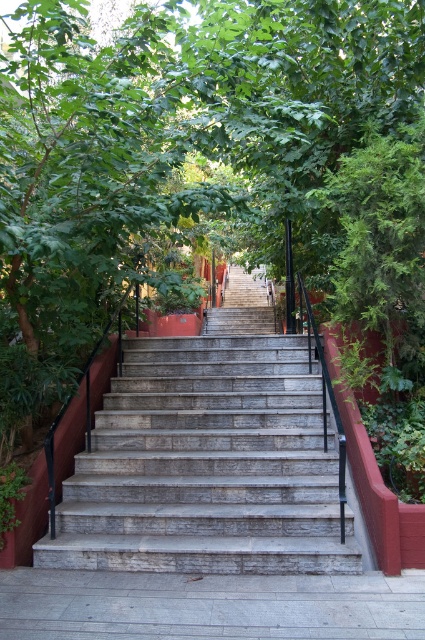
Question: Which point appears closest to the camera in this image?

Choices:
 (A) (166, 564)
 (B) (204, 179)

Answer: (A)

Question: Is green leafy tree at center bigger than gray stone stairs at center?

Choices:
 (A) no
 (B) yes

Answer: (B)

Question: Can you confirm if green leafy tree at center is positioned above gray stone stairs at center?

Choices:
 (A) no
 (B) yes

Answer: (B)

Question: In this image, where is green leafy tree at center located relative to gray stone stairs at center?

Choices:
 (A) left
 (B) right

Answer: (A)